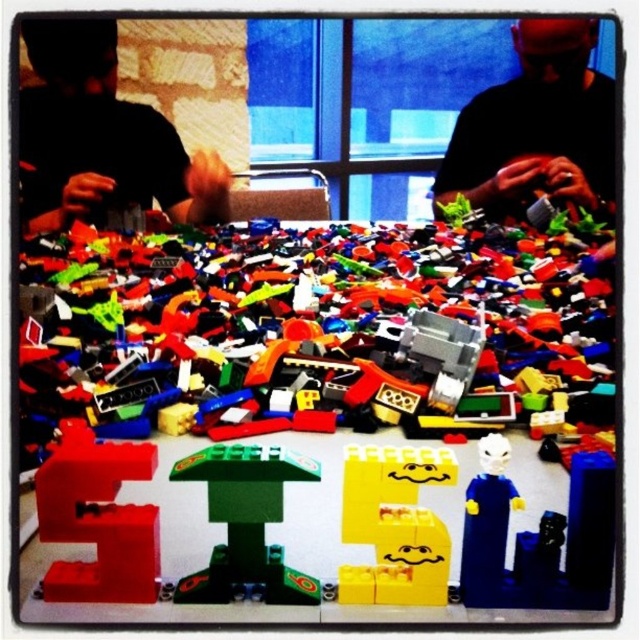
Question: Does black matte shirt at upper left have a larger size compared to rubber red letter s at center?

Choices:
 (A) no
 (B) yes

Answer: (B)

Question: Based on their relative distances, which object is farther from the green matte building block at center?

Choices:
 (A) black matte shirt at upper left
 (B) yellow matte plastic smiley face at center
 (C) rubber red letter s at center

Answer: (A)

Question: Can you confirm if matte black shirt at upper center is positioned to the left of green matte building block at center?

Choices:
 (A) yes
 (B) no

Answer: (B)

Question: Which object appears closest to the camera in this image?

Choices:
 (A) yellow matte plastic smiley face at center
 (B) rubber red letter s at center

Answer: (A)

Question: Among these objects, which one is nearest to the camera?

Choices:
 (A) black matte shirt at upper left
 (B) matte black shirt at upper center
 (C) white plastic minifigure at center
 (D) green matte building block at center

Answer: (C)

Question: Is matte black shirt at upper center wider than yellow matte plastic smiley face at center?

Choices:
 (A) no
 (B) yes

Answer: (B)